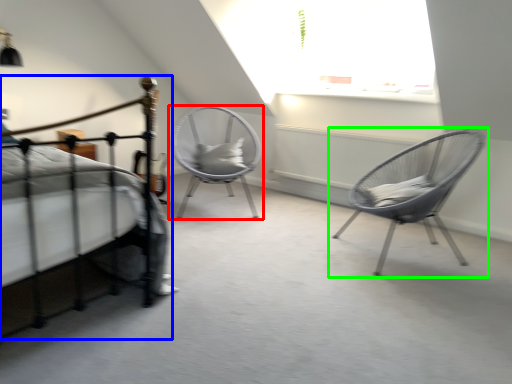
Question: Which object is the closest to the chair (highlighted by a red box)? Choose among these: bed (highlighted by a blue box) or chair (highlighted by a green box).

Choices:
 (A) bed
 (B) chair

Answer: (B)